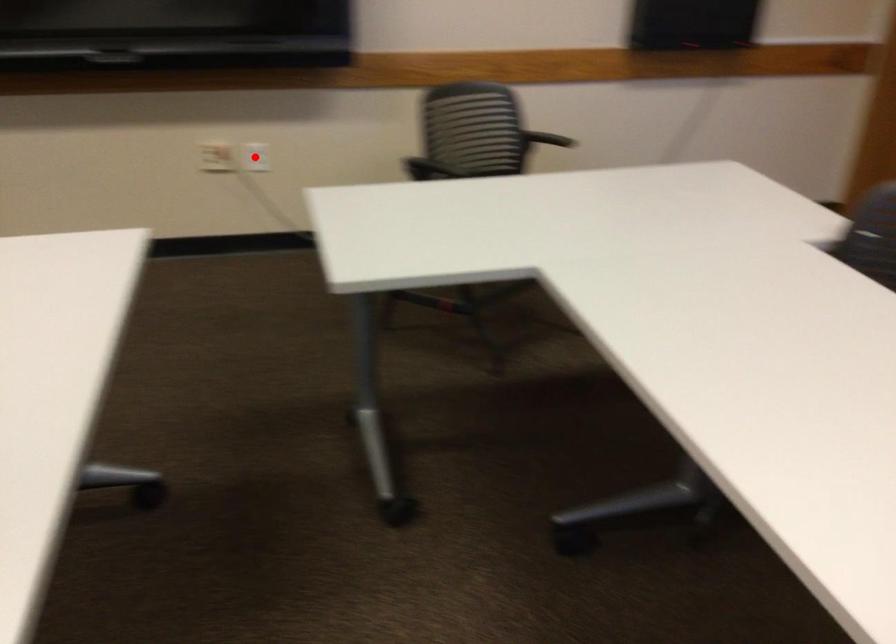
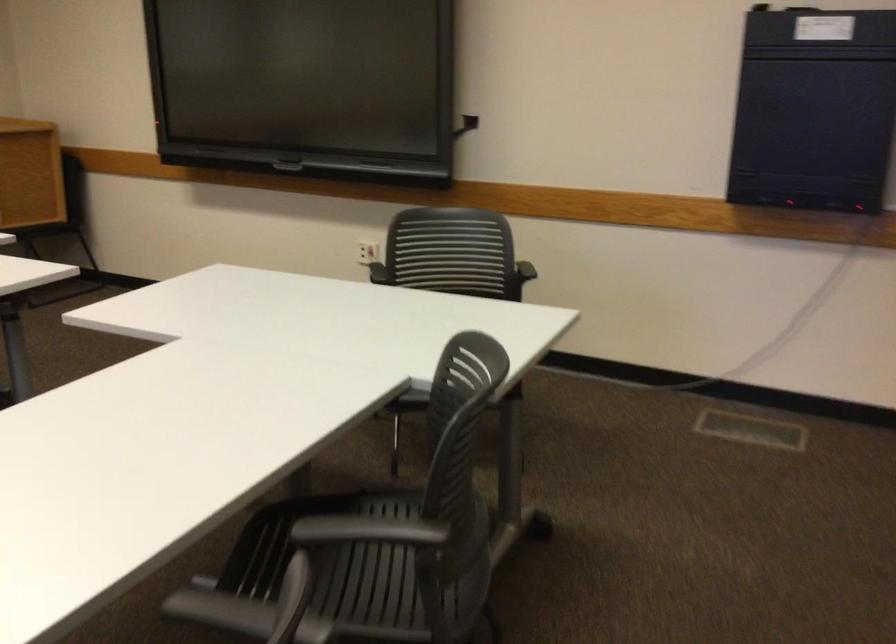
Question: I am providing you with two images of the same scene from different viewpoints. A red point is marked on the first image. At the location where the point appears in image 1, is it still visible in image 2?

Choices:
 (A) Yes
 (B) No

Answer: (B)